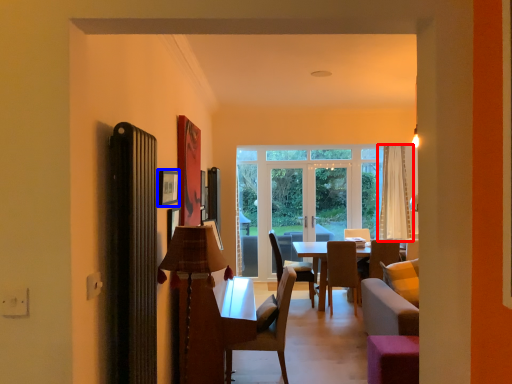
Question: Which of the following is the farthest to the observer, curtain (highlighted by a red box) or picture frame (highlighted by a blue box)?

Choices:
 (A) curtain
 (B) picture frame

Answer: (A)